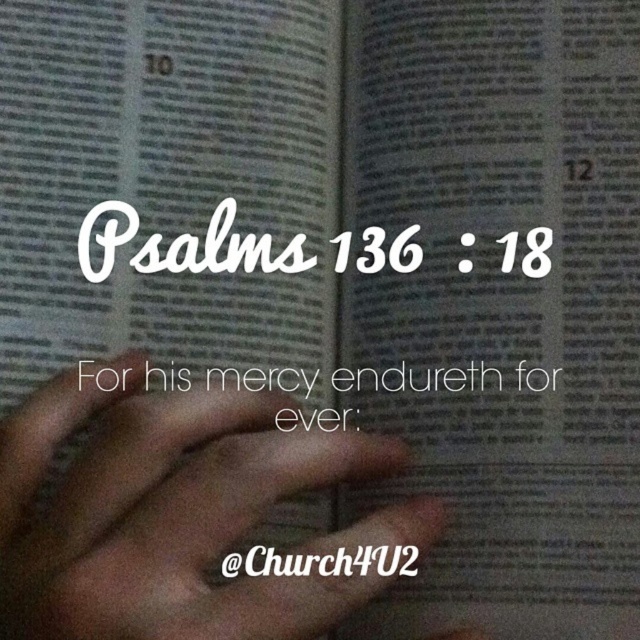
You are a photographer trying to capture the exact position of the brown skin at center in the image. What are the coordinates where you should focus your camera?

The coordinates for the brown skin at center are at point (x=164, y=512).

You are a photographer taking a close up shot of a Bible page. You notice brown skin at center and white paper text at center. Which object is more to the left?

The brown skin at center is more to the left because it is positioned on the left side of white paper text at center.